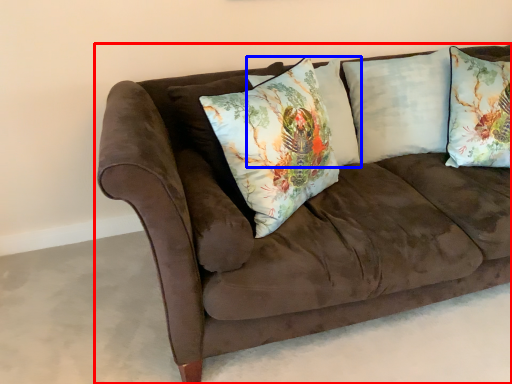
Question: Which of the following is the closest to the observer, studio couch (highlighted by a red box) or pillow (highlighted by a blue box)?

Choices:
 (A) studio couch
 (B) pillow

Answer: (A)